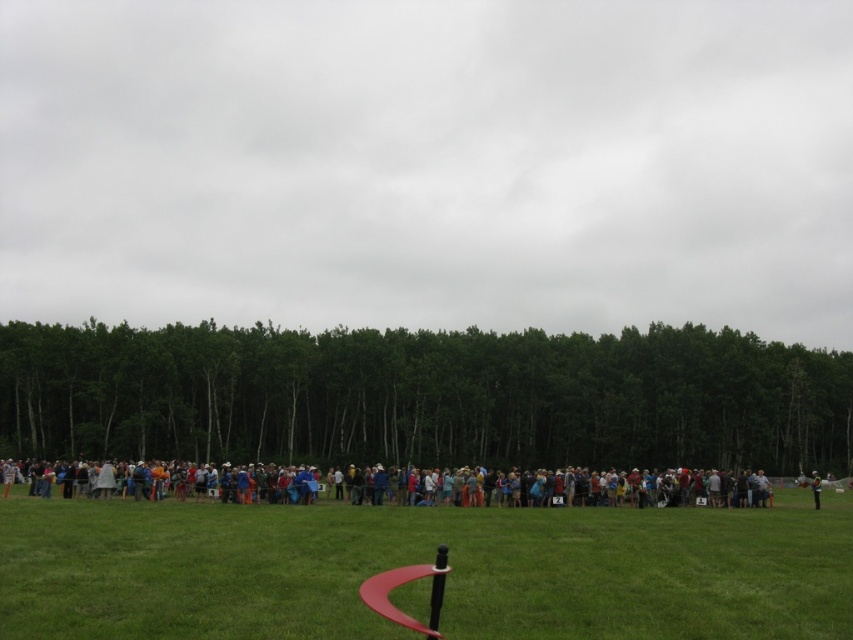
Question: Can you confirm if green grass at center is wider than multicolored clothing at center?

Choices:
 (A) yes
 (B) no

Answer: (B)

Question: Which point is farther to the camera?

Choices:
 (A) reflective silver helmet at lower right
 (B) green grass at center
 (C) green leafy trees at center

Answer: (C)

Question: Which of these objects is positioned closest to the multicolored clothing at center?

Choices:
 (A) green grass at center
 (B) reflective silver helmet at lower right
 (C) green leafy trees at center

Answer: (A)

Question: Does green leafy trees at center appear on the left side of reflective silver helmet at lower right?

Choices:
 (A) no
 (B) yes

Answer: (B)

Question: Can you confirm if green leafy trees at center is positioned below green grass at center?

Choices:
 (A) yes
 (B) no

Answer: (B)

Question: Which object is closer to the camera taking this photo?

Choices:
 (A) reflective silver helmet at lower right
 (B) green leafy trees at center
 (C) green grass at center

Answer: (C)